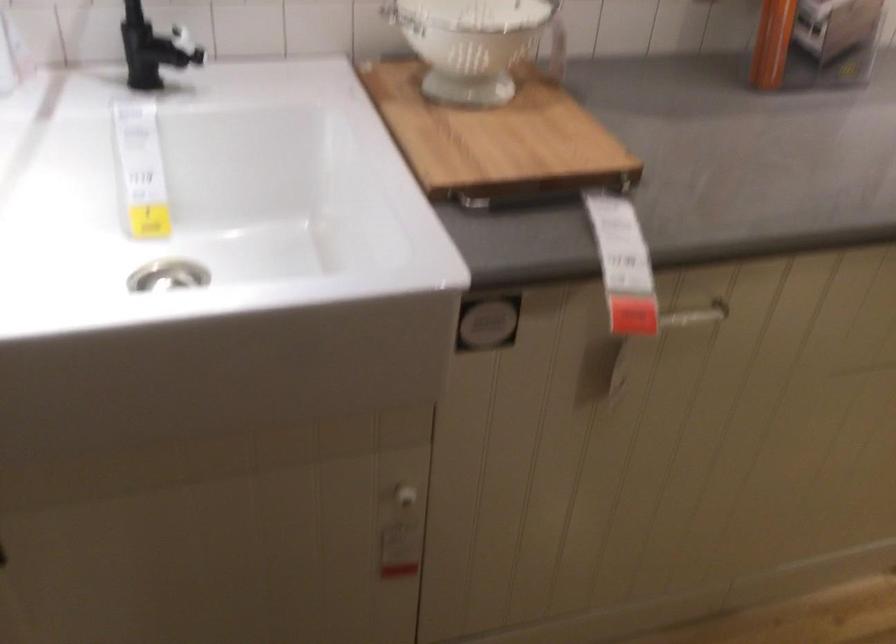
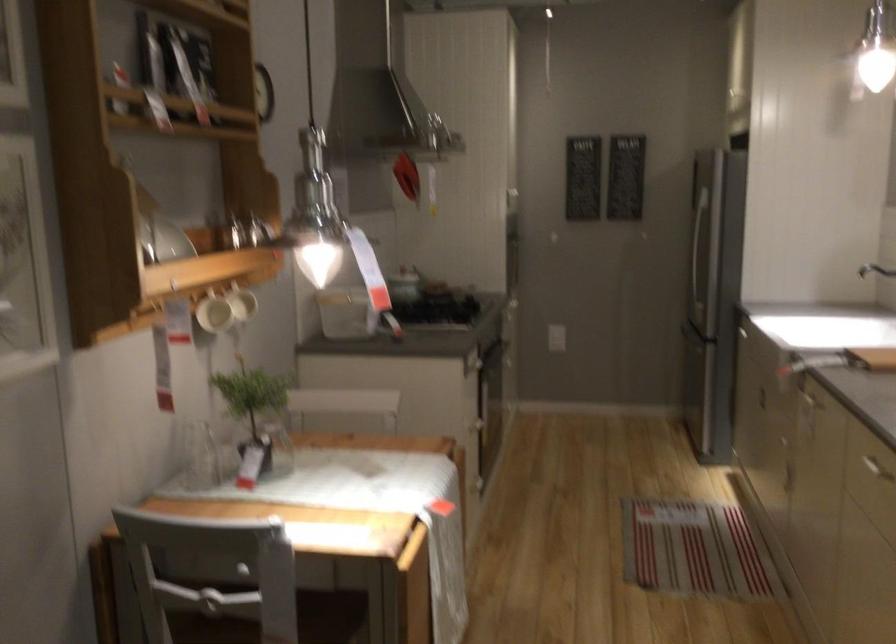
Find the pixel in the second image that matches [544,359] in the first image.

(810, 391)